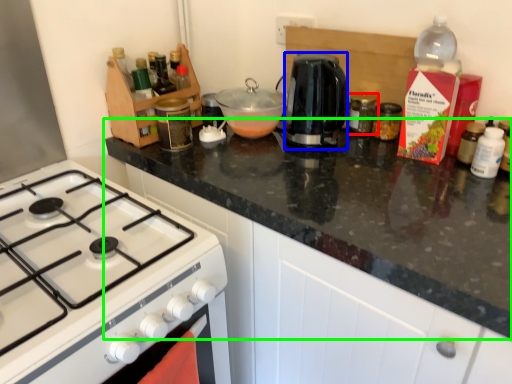
Question: Which is farther away from kitchen appliance (highlighted by a red box)? kitchen appliance (highlighted by a blue box) or countertop (highlighted by a green box)?

Choices:
 (A) kitchen appliance
 (B) countertop

Answer: (B)